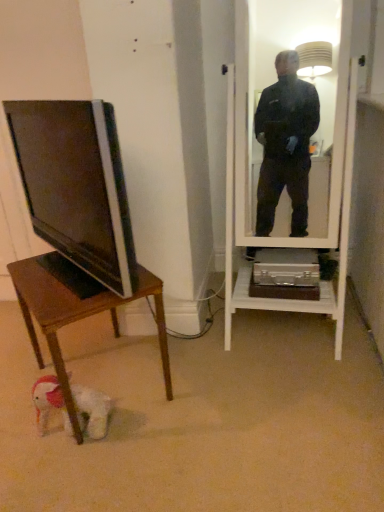
This screenshot has height=512, width=384. I want to click on free location in front of white plush dog at lower left, so click(62, 476).